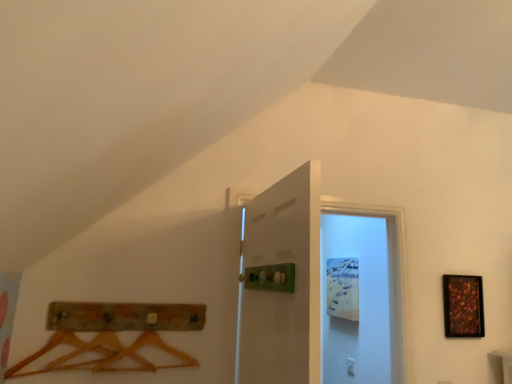
In order to face shiny metallic picture frame at right, should I rotate leftwards or rightwards?

Turn right approximately 26.037 degrees to face it.

What do you see at coordinates (316, 289) in the screenshot?
I see `white matte door at center, arranged as the second door when viewed from the front` at bounding box center [316, 289].

This screenshot has height=384, width=512. I want to click on shiny metallic picture frame at right, so click(463, 306).

Which of these two, white matte door at center, positioned as the 2th door in back-to-front order, or shiny metallic picture frame at right, stands shorter?

With less height is shiny metallic picture frame at right.

Does white matte door at center, positioned as the 2th door in back-to-front order, appear on the right side of shiny metallic picture frame at right?

No.

From the image's perspective, is white matte door at center, positioned as the 2th door in back-to-front order, located above or below shiny metallic picture frame at right?

Clearly, from the image's perspective, white matte door at center, positioned as the 2th door in back-to-front order, is above shiny metallic picture frame at right.

Considering the sizes of white matte door at center, positioned as the 2th door in back-to-front order, and shiny metallic picture frame at right in the image, is white matte door at center, positioned as the 2th door in back-to-front order, wider or thinner than shiny metallic picture frame at right?

Considering their sizes, white matte door at center, positioned as the 2th door in back-to-front order, looks broader than shiny metallic picture frame at right.

Which object is positioned more to the right, white matte door at center, the 1th door from the front, or white matte door at center, which is the first door from back to front?

Positioned to the right is white matte door at center, which is the first door from back to front.

At what (x,y) coordinates should I click in order to perform the action: click on door located on the right of white matte door at center, the 1th door from the front. Please return your answer as a coordinate pair (x, y). The height and width of the screenshot is (384, 512). Looking at the image, I should click on (316, 289).

Relative to white matte door at center, which is the first door from back to front, is white matte door at center, positioned as the 2th door in back-to-front order, in front or behind?

white matte door at center, positioned as the 2th door in back-to-front order, is in front of white matte door at center, which is the first door from back to front.

Are white matte door at center, positioned as the 2th door in back-to-front order, and white matte door at center, which is the first door from back to front, making contact?

white matte door at center, positioned as the 2th door in back-to-front order, is not next to white matte door at center, which is the first door from back to front, and they're not touching.

Considering their positions, is shiny metallic picture frame at right located in front of or behind white matte door at center, which is the first door from back to front?

In the image, shiny metallic picture frame at right appears behind white matte door at center, which is the first door from back to front.

From the picture: Is shiny metallic picture frame at right not near white matte door at center, which is the first door from back to front?

No, shiny metallic picture frame at right is in close proximity to white matte door at center, which is the first door from back to front.

Between shiny metallic picture frame at right and white matte door at center, which is the first door from back to front, which one appears on the left side from the viewer's perspective?

white matte door at center, which is the first door from back to front, is more to the left.

From the image's perspective, is shiny metallic picture frame at right on white matte door at center, which is the first door from back to front?

No, from the image's perspective, shiny metallic picture frame at right is not on top of white matte door at center, which is the first door from back to front.

From a real-world perspective, which is physically above, white matte door at center, arranged as the second door when viewed from the front, or white matte door at center, the 1th door from the front?

white matte door at center, arranged as the second door when viewed from the front.

How many degrees apart are the facing directions of white matte door at center, arranged as the second door when viewed from the front, and white matte door at center, positioned as the 2th door in back-to-front order?

The angle between the facing direction of white matte door at center, arranged as the second door when viewed from the front, and the facing direction of white matte door at center, positioned as the 2th door in back-to-front order, is 89.3 degrees.

Considering the relative sizes of white matte door at center, which is the first door from back to front, and white matte door at center, positioned as the 2th door in back-to-front order, in the image provided, is white matte door at center, which is the first door from back to front, bigger than white matte door at center, positioned as the 2th door in back-to-front order,?

Yes, white matte door at center, which is the first door from back to front, is bigger than white matte door at center, positioned as the 2th door in back-to-front order.

This screenshot has height=384, width=512. I want to click on door on the right of white matte door at center, the 1th door from the front, so click(316, 289).

From a real-world perspective, which door is the 1st one above the shiny metallic picture frame at right? Please provide its 2D coordinates.

[(282, 283)]

Which of these two, shiny metallic picture frame at right or white matte door at center, the 1th door from the front, is thinner?

shiny metallic picture frame at right.

What's the angular difference between shiny metallic picture frame at right and white matte door at center, positioned as the 2th door in back-to-front order,'s facing directions?

They differ by 86.8 degrees in their facing directions.

Considering the sizes of objects shiny metallic picture frame at right and white matte door at center, positioned as the 2th door in back-to-front order, in the image provided, who is bigger, shiny metallic picture frame at right or white matte door at center, positioned as the 2th door in back-to-front order,?

Bigger between the two is white matte door at center, positioned as the 2th door in back-to-front order.

From the image's perspective, count 1st doors upward from the shiny metallic picture frame at right and point to it. Please provide its 2D coordinates.

[(316, 289)]

From a real-world perspective, who is located lower, white matte door at center, which is the first door from back to front, or shiny metallic picture frame at right?

In real-world perspective, shiny metallic picture frame at right is lower.

Do you think white matte door at center, arranged as the second door when viewed from the front, is within shiny metallic picture frame at right, or outside of it?

The correct answer is: outside.

Image resolution: width=512 pixels, height=384 pixels. In order to click on picture frame on the right side of white matte door at center, the 1th door from the front in this screenshot , I will do `click(463, 306)`.

I want to click on door on the left of white matte door at center, arranged as the second door when viewed from the front, so click(282, 283).

Looking at the image, which one is located closer to shiny metallic picture frame at right, white matte door at center, the 1th door from the front, or white matte door at center, arranged as the second door when viewed from the front?

white matte door at center, arranged as the second door when viewed from the front, is closer to shiny metallic picture frame at right.

Based on their spatial positions, is shiny metallic picture frame at right or white matte door at center, which is the first door from back to front, further from white matte door at center, positioned as the 2th door in back-to-front order?

shiny metallic picture frame at right is positioned further to the anchor white matte door at center, positioned as the 2th door in back-to-front order.

Looking at this image, based on their spatial positions, is white matte door at center, the 1th door from the front, or shiny metallic picture frame at right further from white matte door at center, arranged as the second door when viewed from the front?

white matte door at center, the 1th door from the front, is positioned further to the anchor white matte door at center, arranged as the second door when viewed from the front.

Looking at this image, estimate the real-world distances between objects in this image. Which object is further from shiny metallic picture frame at right, white matte door at center, which is the first door from back to front, or white matte door at center, the 1th door from the front?

white matte door at center, the 1th door from the front, is positioned further to the anchor shiny metallic picture frame at right.

Estimate the real-world distances between objects in this image. Which object is closer to white matte door at center, which is the first door from back to front, shiny metallic picture frame at right or white matte door at center, the 1th door from the front?

The object closer to white matte door at center, which is the first door from back to front, is shiny metallic picture frame at right.

Looking at the image, which one is located further to white matte door at center, positioned as the 2th door in back-to-front order, white matte door at center, which is the first door from back to front, or shiny metallic picture frame at right?

shiny metallic picture frame at right.

Locate an element on the screen. Image resolution: width=512 pixels, height=384 pixels. door located between white matte door at center, positioned as the 2th door in back-to-front order, and shiny metallic picture frame at right in the depth direction is located at coordinates (316, 289).